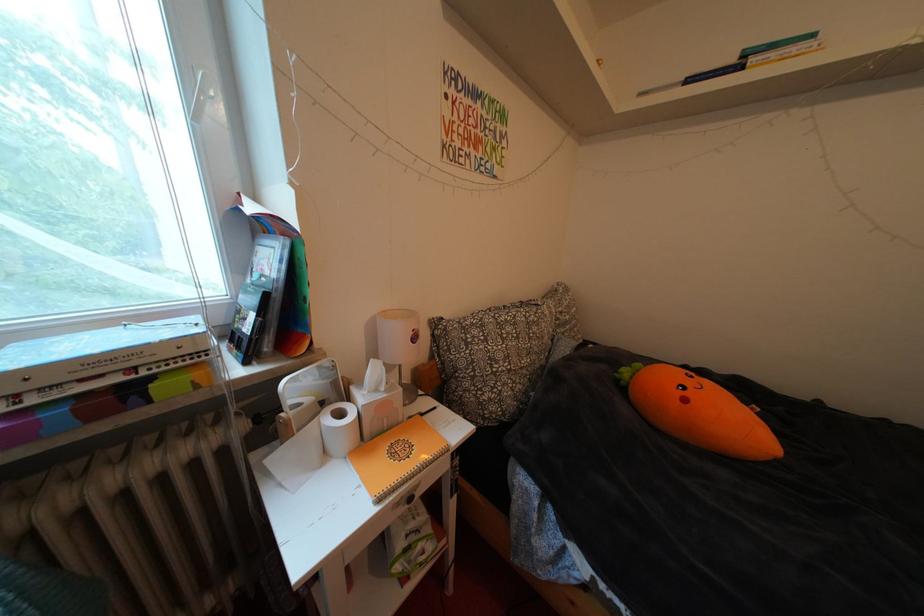
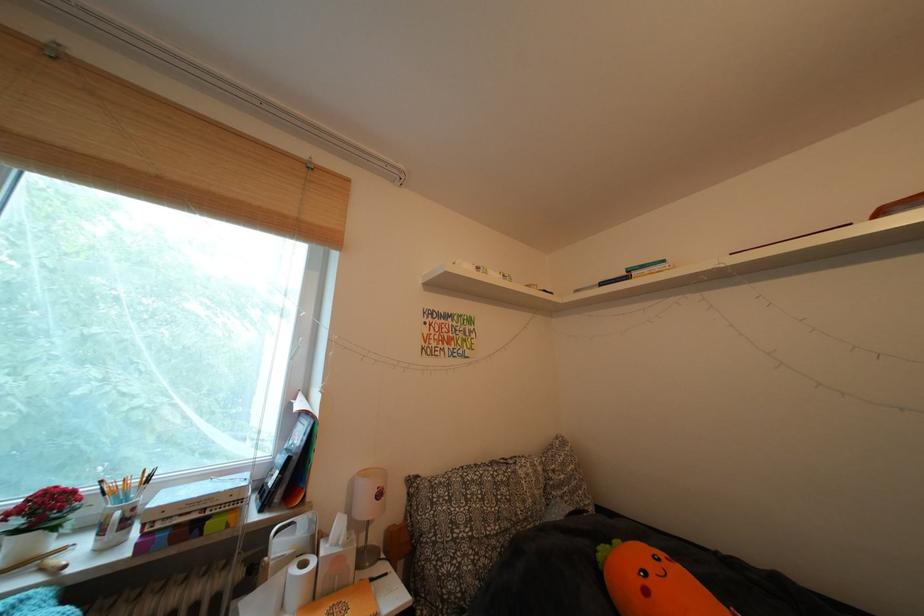
In the second image, find the point that corresponds to point (695, 405) in the first image.

(657, 597)